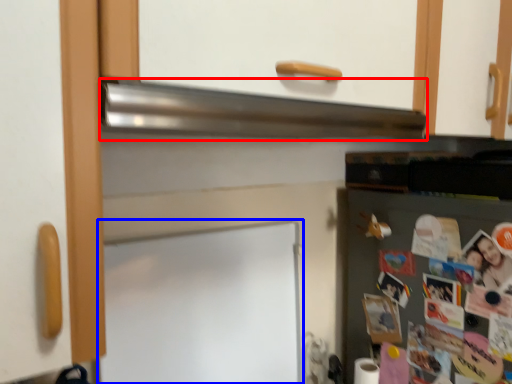
Question: Which point is further to the camera, exhaust hood (highlighted by a red box) or bulletin board (highlighted by a blue box)?

Choices:
 (A) exhaust hood
 (B) bulletin board

Answer: (B)